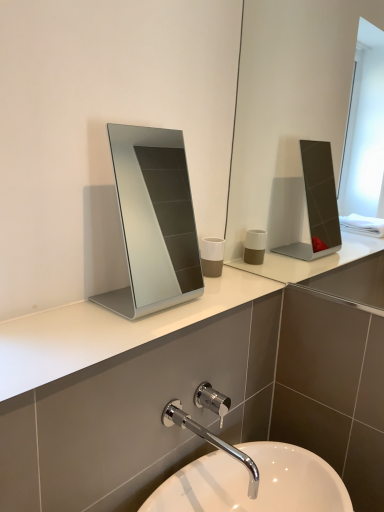
Question: Is white glossy sink at lower center further to the viewer compared to silver metallic mirror at center?

Choices:
 (A) yes
 (B) no

Answer: (B)

Question: From the image's perspective, is white glossy sink at lower center over silver metallic mirror at center?

Choices:
 (A) yes
 (B) no

Answer: (B)

Question: Does white glossy sink at lower center appear on the left side of silver metallic mirror at center?

Choices:
 (A) yes
 (B) no

Answer: (B)

Question: Is white glossy sink at lower center closer to camera compared to silver metallic mirror at center?

Choices:
 (A) yes
 (B) no

Answer: (A)

Question: Is silver metallic mirror at center completely or partially inside white glossy sink at lower center?

Choices:
 (A) yes
 (B) no

Answer: (B)

Question: Considering the positions of white glossy sink at lower center and chrome metallic faucet at lower center in the image, is white glossy sink at lower center taller or shorter than chrome metallic faucet at lower center?

Choices:
 (A) tall
 (B) short

Answer: (A)

Question: Considering the positions of white glossy sink at lower center and chrome metallic faucet at lower center in the image, is white glossy sink at lower center wider or thinner than chrome metallic faucet at lower center?

Choices:
 (A) thin
 (B) wide

Answer: (B)

Question: From the image's perspective, relative to chrome metallic faucet at lower center, is white glossy sink at lower center above or below?

Choices:
 (A) below
 (B) above

Answer: (A)

Question: In the image, is white glossy sink at lower center on the left side or the right side of chrome metallic faucet at lower center?

Choices:
 (A) right
 (B) left

Answer: (A)

Question: Is white glossy sink at lower center taller or shorter than white matte cup at center?

Choices:
 (A) tall
 (B) short

Answer: (B)

Question: Looking at their shapes, would you say white glossy sink at lower center is wider or thinner than white matte cup at center?

Choices:
 (A) thin
 (B) wide

Answer: (B)

Question: Considering the positions of point (195, 477) and point (205, 274), is point (195, 477) closer or farther from the camera than point (205, 274)?

Choices:
 (A) closer
 (B) farther

Answer: (A)

Question: Would you say white glossy sink at lower center is inside or outside white matte cup at center?

Choices:
 (A) outside
 (B) inside

Answer: (A)

Question: Considering the positions of white matte cup at center and chrome metallic faucet at lower center in the image, is white matte cup at center wider or thinner than chrome metallic faucet at lower center?

Choices:
 (A) thin
 (B) wide

Answer: (A)

Question: From the image's perspective, relative to chrome metallic faucet at lower center, is white matte cup at center above or below?

Choices:
 (A) above
 (B) below

Answer: (A)